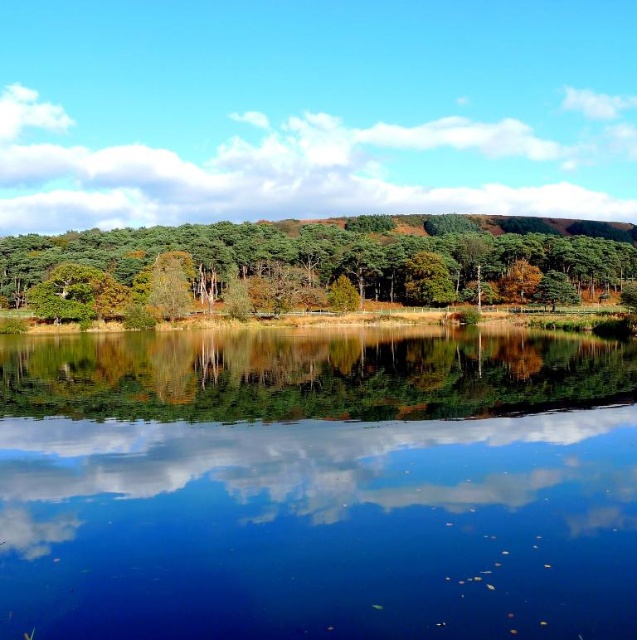
Which is below, transparent glass water at center or green matte tree at center?

transparent glass water at center is lower down.

Is transparent glass water at center bigger than green matte tree at center?

No.

Image resolution: width=637 pixels, height=640 pixels. Describe the element at coordinates (317, 484) in the screenshot. I see `transparent glass water at center` at that location.

This screenshot has height=640, width=637. Find the location of `transparent glass water at center`. transparent glass water at center is located at coordinates (317, 484).

Which is behind, point (231, 168) or point (233, 241)?

Positioned behind is point (231, 168).

Does white fluffy cloud at upper center appear over green matte tree at center?

Correct, white fluffy cloud at upper center is located above green matte tree at center.

Where is `white fluffy cloud at upper center`? The height and width of the screenshot is (640, 637). white fluffy cloud at upper center is located at coordinates (269, 172).

Where is `white fluffy cloud at upper center`? The width and height of the screenshot is (637, 640). white fluffy cloud at upper center is located at coordinates (269, 172).

Who is taller, transparent glass water at center or white fluffy cloud at upper center?

Standing taller between the two is white fluffy cloud at upper center.

Does transparent glass water at center come in front of white fluffy cloud at upper center?

Yes.

You are a GUI agent. You are given a task and a screenshot of the screen. Output one action in this format:
    pyautogui.click(x=<x>, y=<y>)
    Task: Click on the transparent glass water at center
    
    Given the screenshot: What is the action you would take?
    pyautogui.click(x=317, y=484)